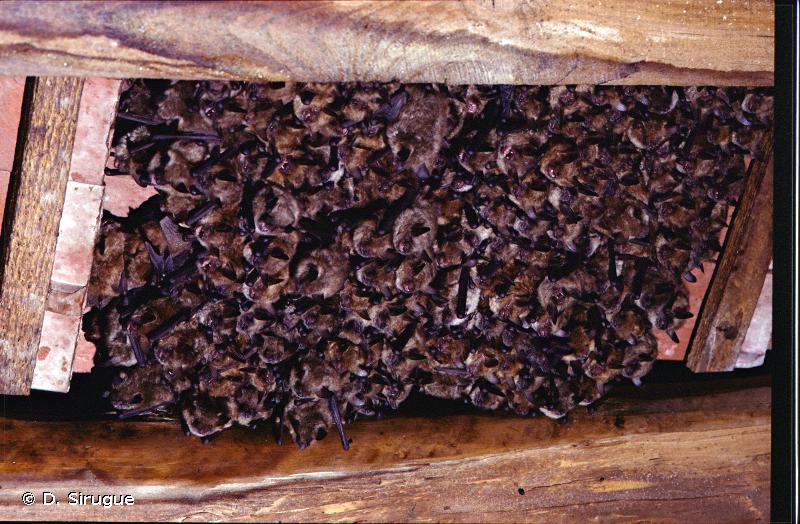
At what (x,y) coordinates should I click in order to perform the action: click on tile. Please return your answer as a coordinate pair (x, y). Looking at the image, I should click on (13, 122).